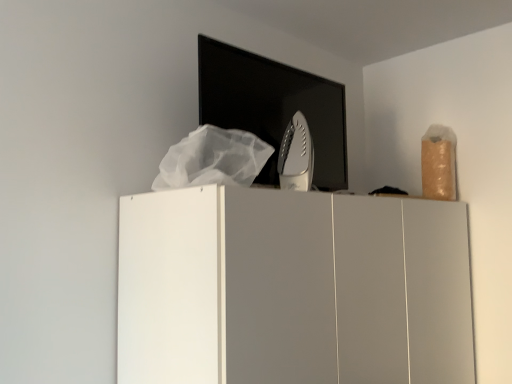
What is the approximate height of white matte cupboard at center?

white matte cupboard at center is 36.49 inches tall.

Identify the location of white matte cupboard at center. (292, 289).

Describe the element at coordinates (292, 289) in the screenshot. Image resolution: width=512 pixels, height=384 pixels. I see `white matte cupboard at center` at that location.

At what (x,y) coordinates should I click in order to perform the action: click on white plastic iron at center. Please return your answer as a coordinate pair (x, y). Looking at the image, I should click on (296, 155).

Image resolution: width=512 pixels, height=384 pixels. What do you see at coordinates (296, 155) in the screenshot?
I see `white plastic iron at center` at bounding box center [296, 155].

You are a GUI agent. You are given a task and a screenshot of the screen. Output one action in this format:
    pyautogui.click(x=<x>, y=<y>)
    Task: Click on the white matte cupboard at center
    This screenshot has width=512, height=384.
    Given the screenshot: What is the action you would take?
    pyautogui.click(x=292, y=289)

From the picture: Which object is positioned more to the right, white plastic iron at center or white matte cupboard at center?

white matte cupboard at center is more to the right.

Between white plastic iron at center and white matte cupboard at center, which one is positioned behind?

white plastic iron at center is behind.

Is point (307, 189) closer to camera compared to point (429, 342)?

No, (307, 189) is behind (429, 342).

Based on the photo, from the image's perspective, is white plastic iron at center above or below white matte cupboard at center?

white plastic iron at center is above white matte cupboard at center.

From a real-world perspective, is white plastic iron at center positioned under white matte cupboard at center based on gravity?

No, from a real-world perspective, white plastic iron at center is not under white matte cupboard at center.

Which of these two, white plastic iron at center or white matte cupboard at center, is wider?

Wider between the two is white matte cupboard at center.

From their relative heights in the image, would you say white plastic iron at center is taller or shorter than white matte cupboard at center?

Clearly, white plastic iron at center is shorter compared to white matte cupboard at center.

Who is bigger, white plastic iron at center or white matte cupboard at center?

white matte cupboard at center.

Do you think white plastic iron at center is within white matte cupboard at center, or outside of it?

white plastic iron at center is not enclosed by white matte cupboard at center.

Are white plastic iron at center and white matte cupboard at center making contact?

white plastic iron at center and white matte cupboard at center are clearly separated.

Is white matte cupboard at center at the back of white plastic iron at center?

No, white matte cupboard at center is not at the back of white plastic iron at center.

Locate an element on the screen. This screenshot has width=512, height=384. home appliance that is on the left side of white matte cupboard at center is located at coordinates (296, 155).

Which is more to the left, white matte cupboard at center or white plastic iron at center?

white plastic iron at center.

Which is behind, white matte cupboard at center or white plastic iron at center?

white plastic iron at center is more distant.

Which is in front, point (419, 327) or point (302, 163)?

Positioned in front is point (419, 327).

From the image's perspective, is white matte cupboard at center positioned above or below white plastic iron at center?

Based on their image positions, white matte cupboard at center is located beneath white plastic iron at center.

Based on the photo, from a real-world perspective, is white matte cupboard at center above or below white plastic iron at center?

In terms of real-world spatial position, white matte cupboard at center is below white plastic iron at center.

Which object is wider, white matte cupboard at center or white plastic iron at center?

white matte cupboard at center.

Considering the sizes of objects white matte cupboard at center and white plastic iron at center in the image provided, who is shorter, white matte cupboard at center or white plastic iron at center?

With less height is white plastic iron at center.

Considering the relative sizes of white matte cupboard at center and white plastic iron at center in the image provided, is white matte cupboard at center bigger than white plastic iron at center?

Indeed, white matte cupboard at center has a larger size compared to white plastic iron at center.

Would you say white matte cupboard at center contains white plastic iron at center?

Actually, white plastic iron at center is outside white matte cupboard at center.

Is white matte cupboard at center touching white plastic iron at center?

white matte cupboard at center and white plastic iron at center are not in contact.

Is white matte cupboard at center oriented away from white plastic iron at center?

No.

What's the angular difference between white matte cupboard at center and white plastic iron at center's facing directions?

There is a 0.271-degree angle between the facing directions of white matte cupboard at center and white plastic iron at center.

Identify the location of home appliance behind the white matte cupboard at center. (296, 155).

There is a white matte cupboard at center. Where is `home appliance above it (from a real-world perspective)`? home appliance above it (from a real-world perspective) is located at coordinates (296, 155).

Identify the location of cupboard that appears in front of the white plastic iron at center. This screenshot has height=384, width=512. (292, 289).